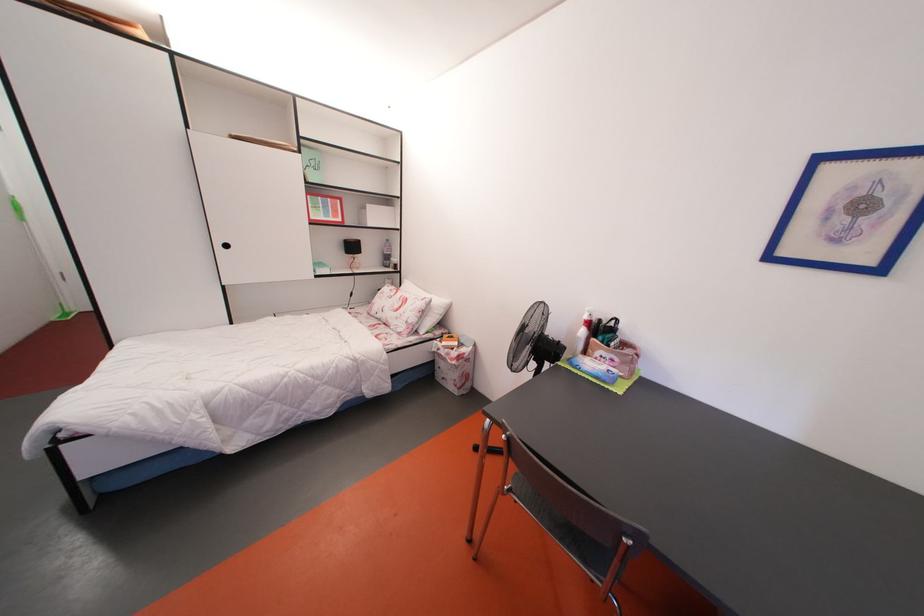
This screenshot has width=924, height=616. Describe the element at coordinates (591, 549) in the screenshot. I see `the chair sitting surface` at that location.